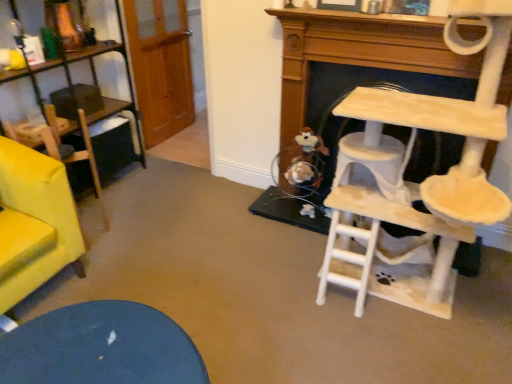
Identify the location of spots to the right of velvet yellow armchair at left. This screenshot has height=384, width=512. (124, 235).